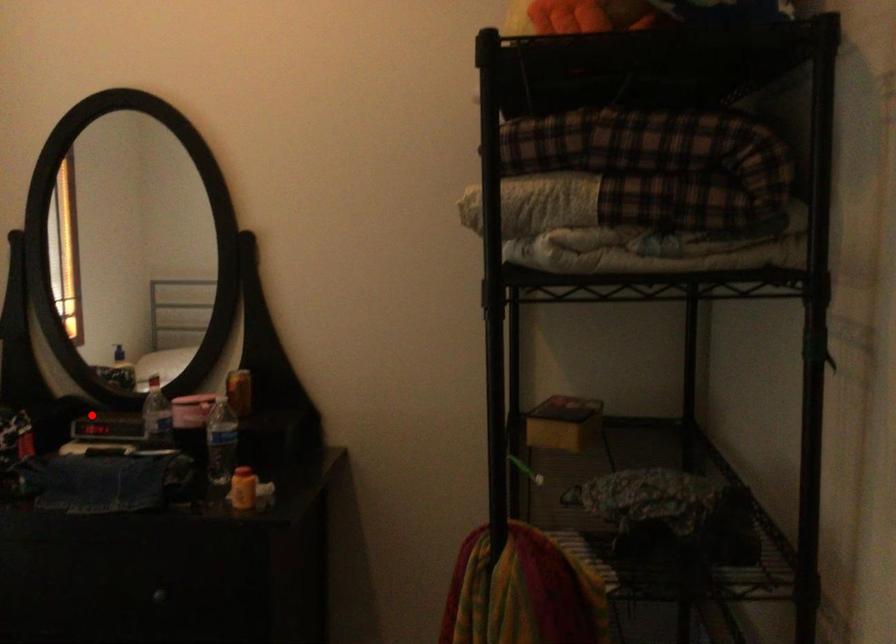
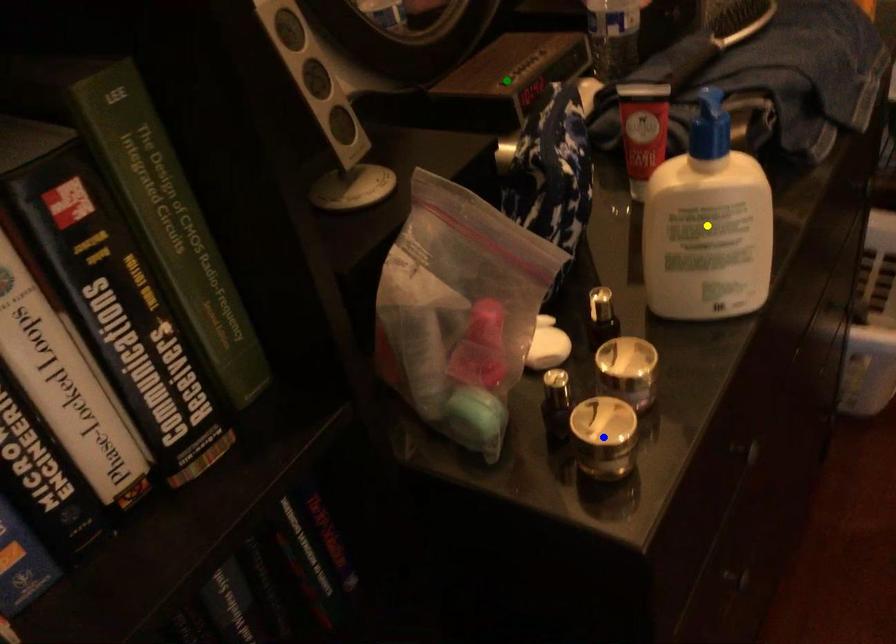
Question: I am providing you with two images of the same scene from different viewpoints. A red point is marked on the first image. You are given multiple points on the second image. Which point in image 2 is actually the same real-world point as the red point in image 1?

Choices:
 (A) blue point
 (B) green point
 (C) yellow point

Answer: (B)